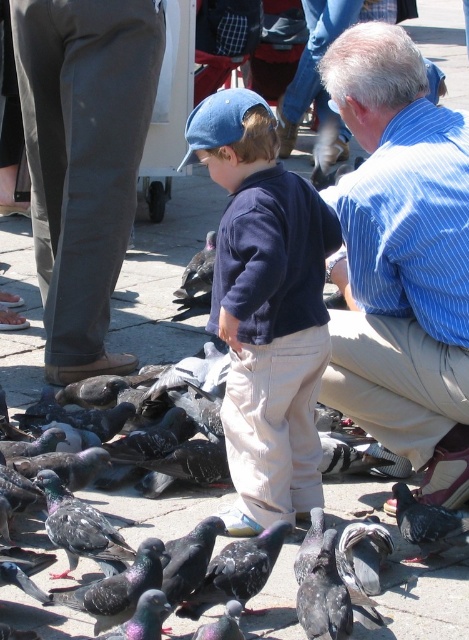
Question: Which object appears farthest from the camera in this image?

Choices:
 (A) dark gray pants at lower left
 (B) matte blue cap at center

Answer: (A)

Question: Does blue striped shirt at upper right appear on the right side of gray speckled feathers at lower right?

Choices:
 (A) no
 (B) yes

Answer: (A)

Question: Which point is closer to the camera taking this photo?

Choices:
 (A) (229, 208)
 (B) (151, 90)
 (C) (370, 150)

Answer: (A)

Question: Among these objects, which one is farthest from the camera?

Choices:
 (A) gray speckled feathers at lower right
 (B) dark gray pants at lower left
 (C) matte blue cap at center
 (D) blue striped shirt at upper right

Answer: (B)

Question: Is blue striped shirt at upper right positioned in front of dark gray pants at lower left?

Choices:
 (A) yes
 (B) no

Answer: (A)

Question: Where is matte blue cap at center located in relation to dark gray pants at lower left in the image?

Choices:
 (A) below
 (B) above

Answer: (A)